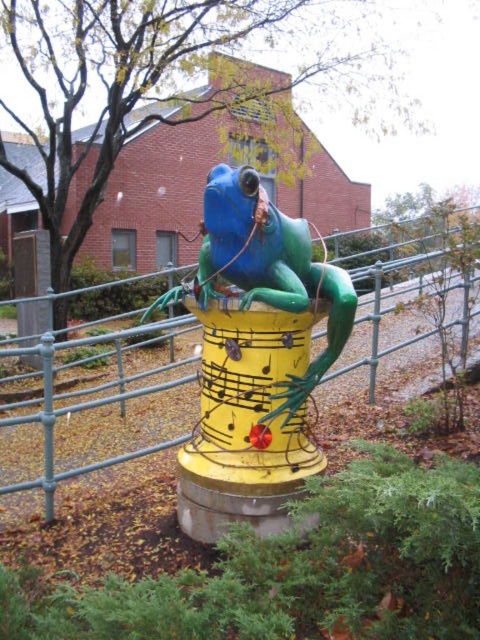
Question: Which is farther from the yellow painted metal at center?

Choices:
 (A) green metal fence at center
 (B) shiny blue frog at center

Answer: (A)

Question: Considering the real-world distances, which object is closest to the green metal fence at center?

Choices:
 (A) yellow painted metal at center
 (B) shiny blue frog at center

Answer: (A)

Question: Which point is closer to the camera?

Choices:
 (A) (468, 205)
 (B) (302, 308)

Answer: (B)

Question: Can you confirm if yellow painted metal at center is smaller than green metal fence at center?

Choices:
 (A) yes
 (B) no

Answer: (A)

Question: Does yellow painted metal at center appear on the left side of shiny blue frog at center?

Choices:
 (A) yes
 (B) no

Answer: (A)

Question: Is yellow painted metal at center thinner than green metal fence at center?

Choices:
 (A) no
 (B) yes

Answer: (B)